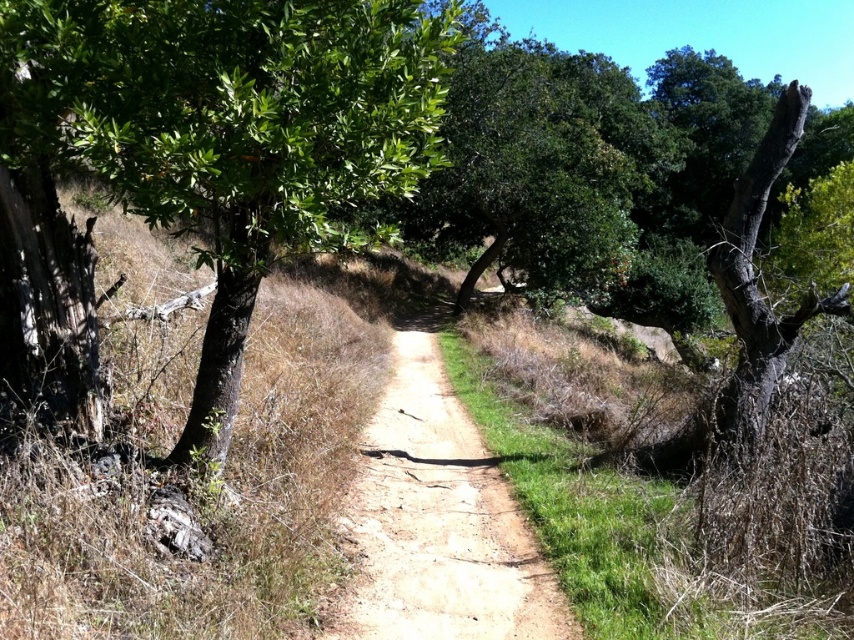
Between green leafy tree at left and dirt path at center, which one is positioned higher?

Positioned higher is green leafy tree at left.

Consider the image. Can you confirm if green leafy tree at left is thinner than dirt path at center?

In fact, green leafy tree at left might be wider than dirt path at center.

Is point (244, 243) positioned in front of point (427, 490)?

Yes, point (244, 243) is closer to viewer.

At what (x,y) coordinates should I click in order to perform the action: click on green leafy tree at left. Please return your answer as a coordinate pair (x, y). Looking at the image, I should click on (227, 131).